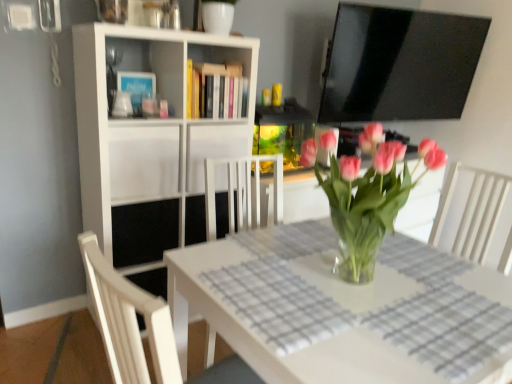
Question: Considering the relative positions of black matte shelf at center, which is the 1th shelf in bottom-to-top order, and white matte cabinet at center, which ranks as the 1th cabinet in right-to-left order, in the image provided, is black matte shelf at center, which is the 1th shelf in bottom-to-top order, to the right of white matte cabinet at center, which ranks as the 1th cabinet in right-to-left order, from the viewer's perspective?

Choices:
 (A) no
 (B) yes

Answer: (A)

Question: Is black matte shelf at center, placed as the second shelf when sorted from top to bottom, taller than white matte cabinet at center, marked as the second cabinet in a left-to-right arrangement?

Choices:
 (A) yes
 (B) no

Answer: (B)

Question: From the image's perspective, is black matte shelf at center, which is the 1th shelf in bottom-to-top order, on white matte cabinet at center, marked as the second cabinet in a left-to-right arrangement?

Choices:
 (A) yes
 (B) no

Answer: (B)

Question: From a real-world perspective, is black matte shelf at center, placed as the second shelf when sorted from top to bottom, positioned over white matte cabinet at center, marked as the second cabinet in a left-to-right arrangement, based on gravity?

Choices:
 (A) no
 (B) yes

Answer: (A)

Question: Is black matte shelf at center, placed as the second shelf when sorted from top to bottom, thinner than white matte cabinet at center, marked as the second cabinet in a left-to-right arrangement?

Choices:
 (A) no
 (B) yes

Answer: (A)

Question: Considering their positions, is white matte cabinet at center, the 1th cabinet when ordered from left to right, located in front of or behind pink glass vase at center?

Choices:
 (A) front
 (B) behind

Answer: (B)

Question: Based on their positions, is white matte cabinet at center, the second cabinet positioned from the right, located to the left or right of pink glass vase at center?

Choices:
 (A) right
 (B) left

Answer: (B)

Question: Does point (159, 190) appear closer or farther from the camera than point (425, 144)?

Choices:
 (A) closer
 (B) farther

Answer: (B)

Question: Choose the correct answer: Is white matte cabinet at center, the 1th cabinet when ordered from left to right, inside pink glass vase at center or outside it?

Choices:
 (A) outside
 (B) inside

Answer: (A)

Question: Considering the positions of pink glass vase at center and white matte cabinet at center, the second cabinet positioned from the right, in the image, is pink glass vase at center wider or thinner than white matte cabinet at center, the second cabinet positioned from the right,?

Choices:
 (A) thin
 (B) wide

Answer: (A)

Question: In the image, is pink glass vase at center on the left side or the right side of white matte cabinet at center, the 1th cabinet when ordered from left to right?

Choices:
 (A) right
 (B) left

Answer: (A)

Question: Is pink glass vase at center inside the boundaries of white matte cabinet at center, the 1th cabinet when ordered from left to right, or outside?

Choices:
 (A) inside
 (B) outside

Answer: (B)

Question: Is pink glass vase at center in front of or behind white matte cabinet at center, the 1th cabinet when ordered from left to right, in the image?

Choices:
 (A) behind
 (B) front

Answer: (B)

Question: Is point (120, 132) closer or farther from the camera than point (242, 71)?

Choices:
 (A) closer
 (B) farther

Answer: (A)

Question: Considering the positions of white matte cabinet at center, the 1th cabinet when ordered from left to right, and hardcover books at upper center in the image, is white matte cabinet at center, the 1th cabinet when ordered from left to right, bigger or smaller than hardcover books at upper center?

Choices:
 (A) small
 (B) big

Answer: (B)